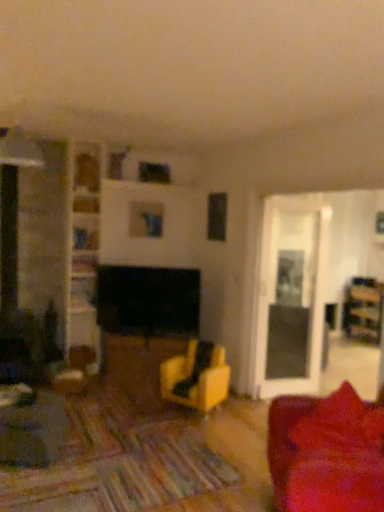
The image size is (384, 512). Describe the element at coordinates (327, 453) in the screenshot. I see `velvet red couch at lower right` at that location.

The width and height of the screenshot is (384, 512). What do you see at coordinates (364, 309) in the screenshot?
I see `wooden bookshelf at right` at bounding box center [364, 309].

Measure the distance between wooden bookshelf at left, the fourth shelf when ordered from top to bottom, and camera.

wooden bookshelf at left, the fourth shelf when ordered from top to bottom, and camera are 4.50 meters apart from each other.

You are a GUI agent. You are given a task and a screenshot of the screen. Output one action in this format:
    pyautogui.click(x=<x>, y=<y>)
    Task: Click on the wooden shelf at upper center, which is the 1th shelf from top to bottom
    This screenshot has height=512, width=384.
    Given the screenshot: What is the action you would take?
    pyautogui.click(x=86, y=204)

What is the approximate width of wooden bookshelf at center, the 3th shelf when ordered from top to bottom?

The width of wooden bookshelf at center, the 3th shelf when ordered from top to bottom, is 9.02 inches.

Identify the location of wooden bookshelf at center, the 3th shelf when ordered from top to bottom. (84, 264).

Where is `velvet red couch at lower right`? velvet red couch at lower right is located at coordinates (327, 453).

Considering the relative positions of wooden bookshelf at right and wooden bookshelf at center, which is the second shelf in bottom-to-top order, in the image provided, is wooden bookshelf at right to the left or to the right of wooden bookshelf at center, which is the second shelf in bottom-to-top order,?

Clearly, wooden bookshelf at right is on the right of wooden bookshelf at center, which is the second shelf in bottom-to-top order, in the image.

Is wooden bookshelf at right next to wooden bookshelf at center, which is the second shelf in bottom-to-top order?

No, wooden bookshelf at right is not making contact with wooden bookshelf at center, which is the second shelf in bottom-to-top order.

Considering the positions of objects wooden bookshelf at right and wooden bookshelf at center, the 3th shelf when ordered from top to bottom, in the image provided, who is in front, wooden bookshelf at right or wooden bookshelf at center, the 3th shelf when ordered from top to bottom,?

wooden bookshelf at center, the 3th shelf when ordered from top to bottom, is more forward.

From the picture: From the image's perspective, does wooden bookshelf at right appear lower than wooden bookshelf at center, the 3th shelf when ordered from top to bottom?

Indeed, from the image's perspective, wooden bookshelf at right is shown beneath wooden bookshelf at center, the 3th shelf when ordered from top to bottom.

Based on their sizes in the image, would you say velvet red couch at lower right is bigger or smaller than wooden shelf at upper center, which is the 1th shelf from top to bottom?

velvet red couch at lower right is bigger than wooden shelf at upper center, which is the 1th shelf from top to bottom.

Can you confirm if velvet red couch at lower right is shorter than wooden shelf at upper center, which is the 1th shelf from top to bottom?

In fact, velvet red couch at lower right may be taller than wooden shelf at upper center, which is the 1th shelf from top to bottom.

Can you tell me how much velvet red couch at lower right and wooden shelf at upper center, which is the 1th shelf from top to bottom, differ in facing direction?

106 degrees separate the facing orientations of velvet red couch at lower right and wooden shelf at upper center, which is the 1th shelf from top to bottom.

From the image's perspective, which is below, velvet red couch at lower right or wooden shelf at upper center, which ranks as the fourth shelf in bottom-to-top order?

From the image's view, velvet red couch at lower right is below.

Is matte yellow chair at center behind wooden bookshelf at right?

No, the depth of matte yellow chair at center is less than that of wooden bookshelf at right.

Does point (228, 386) come farther from viewer compared to point (378, 298)?

No.

Could wooden bookshelf at right be considered to be inside matte yellow chair at center?

No, wooden bookshelf at right is not surrounded by matte yellow chair at center.

Is matte yellow chair at center positioned with its back to wooden bookshelf at right?

Yes.

From the wooden shelf at upper center, which is the 1th shelf from top to bottom, count 2nd shelfs forward and point to it. Please provide its 2D coordinates.

[(83, 293)]

From the image's perspective, does wooden bookshelf at left, which is the first shelf from bottom to top, appear lower than wooden shelf at upper center, which ranks as the fourth shelf in bottom-to-top order?

Yes, from the image's perspective, wooden bookshelf at left, which is the first shelf from bottom to top, is below wooden shelf at upper center, which ranks as the fourth shelf in bottom-to-top order.

Considering the points (95, 296) and (97, 202), which point is behind, point (95, 296) or point (97, 202)?

The point (95, 296) is more distant.

Is wooden bookshelf at left, which is the first shelf from bottom to top, looking in the opposite direction of wooden shelf at upper center, which is the 1th shelf from top to bottom?

wooden bookshelf at left, which is the first shelf from bottom to top, does not have its back to wooden shelf at upper center, which is the 1th shelf from top to bottom.

Is wooden bookshelf at upper left, the second shelf from the top, wider or thinner than wooden shelf at upper center, which ranks as the fourth shelf in bottom-to-top order?

Considering their sizes, wooden bookshelf at upper left, the second shelf from the top, looks broader than wooden shelf at upper center, which ranks as the fourth shelf in bottom-to-top order.

From a real-world perspective, is wooden bookshelf at upper left, the second shelf from the top, above or below wooden shelf at upper center, which ranks as the fourth shelf in bottom-to-top order?

In terms of real-world spatial position, wooden bookshelf at upper left, the second shelf from the top, is below wooden shelf at upper center, which ranks as the fourth shelf in bottom-to-top order.

Is wooden bookshelf at upper left, which is counted as the third shelf, starting from the bottom, situated inside wooden shelf at upper center, which is the 1th shelf from top to bottom, or outside?

wooden bookshelf at upper left, which is counted as the third shelf, starting from the bottom, is spatially situated outside wooden shelf at upper center, which is the 1th shelf from top to bottom.

From the picture: Which of these two, wooden bookshelf at upper left, which is counted as the third shelf, starting from the bottom, or wooden shelf at upper center, which ranks as the fourth shelf in bottom-to-top order, stands shorter?

wooden shelf at upper center, which ranks as the fourth shelf in bottom-to-top order, is shorter.

Is point (152, 386) closer to camera compared to point (94, 229)?

Yes, point (152, 386) is in front of point (94, 229).

Is matte wood table at center to the right of wooden bookshelf at upper left, which is counted as the third shelf, starting from the bottom, from the viewer's perspective?

Yes.

How different are the orientations of matte wood table at center and wooden bookshelf at upper left, which is counted as the third shelf, starting from the bottom, in degrees?

The facing directions of matte wood table at center and wooden bookshelf at upper left, which is counted as the third shelf, starting from the bottom, are 31.7 degrees apart.

Considering the sizes of matte wood table at center and wooden bookshelf at upper left, the second shelf from the top, in the image, is matte wood table at center taller or shorter than wooden bookshelf at upper left, the second shelf from the top,?

In the image, matte wood table at center appears to be taller than wooden bookshelf at upper left, the second shelf from the top.

Would you consider matte wood table at center to be distant from velvet red couch at lower right?

That's right, there is a large distance between matte wood table at center and velvet red couch at lower right.

Does matte wood table at center turn towards velvet red couch at lower right?

Yes, matte wood table at center is facing velvet red couch at lower right.

Considering the positions of objects matte wood table at center and velvet red couch at lower right in the image provided, who is more to the left, matte wood table at center or velvet red couch at lower right?

matte wood table at center is more to the left.

Considering the sizes of objects matte wood table at center and velvet red couch at lower right in the image provided, who is wider, matte wood table at center or velvet red couch at lower right?

With larger width is velvet red couch at lower right.

Identify the location of shelf that is the 2nd one when counting upward from the wooden bookshelf at right (from the image's perspective). (84, 264).

You are a GUI agent. You are given a task and a screenshot of the screen. Output one action in this format:
    pyautogui.click(x=<x>, y=<y>)
    Task: Click on the studio couch that appears on the right of wooden shelf at upper center, which is the 1th shelf from top to bottom
    The image size is (384, 512).
    Given the screenshot: What is the action you would take?
    pyautogui.click(x=327, y=453)

Estimate the real-world distances between objects in this image. Which object is further from wooden shelf at upper center, which is the 1th shelf from top to bottom, wooden bookshelf at right or matte yellow chair at center?

wooden bookshelf at right lies further to wooden shelf at upper center, which is the 1th shelf from top to bottom, than the other object.

Estimate the real-world distances between objects in this image. Which object is closer to wooden bookshelf at upper left, the second shelf from the top, wooden bookshelf at center, the 3th shelf when ordered from top to bottom, or wooden shelf at upper center, which ranks as the fourth shelf in bottom-to-top order?

wooden shelf at upper center, which ranks as the fourth shelf in bottom-to-top order.

When comparing their distances from wooden bookshelf at left, which is the first shelf from bottom to top, does matte yellow chair at center or wooden bookshelf at right seem further?

The object further to wooden bookshelf at left, which is the first shelf from bottom to top, is wooden bookshelf at right.

From the image, which object appears to be nearer to matte yellow chair at center, wooden bookshelf at right or matte wood table at center?

matte wood table at center is positioned closer to the anchor matte yellow chair at center.

From the image, which object appears to be nearer to wooden bookshelf at left, which is the first shelf from bottom to top, velvet red couch at lower right or wooden bookshelf at right?

velvet red couch at lower right is positioned closer to the anchor wooden bookshelf at left, which is the first shelf from bottom to top.

Looking at the image, which one is located closer to wooden bookshelf at center, which is the second shelf in bottom-to-top order, velvet red couch at lower right or matte yellow chair at center?

matte yellow chair at center is positioned closer to the anchor wooden bookshelf at center, which is the second shelf in bottom-to-top order.

Estimate the real-world distances between objects in this image. Which object is closer to wooden bookshelf at left, which is the first shelf from bottom to top, wooden shelf at upper center, which ranks as the fourth shelf in bottom-to-top order, or matte yellow chair at center?

wooden shelf at upper center, which ranks as the fourth shelf in bottom-to-top order.

Looking at the image, which one is located closer to wooden bookshelf at center, the 3th shelf when ordered from top to bottom, wooden bookshelf at left, which is the first shelf from bottom to top, or wooden bookshelf at upper left, the second shelf from the top?

wooden bookshelf at left, which is the first shelf from bottom to top, is positioned closer to the anchor wooden bookshelf at center, the 3th shelf when ordered from top to bottom.

At what (x,y) coordinates should I click in order to perform the action: click on table between velvet red couch at lower right and wooden bookshelf at center, the 3th shelf when ordered from top to bottom, in the front-back direction. Please return your answer as a coordinate pair (x, y). Looking at the image, I should click on (139, 367).

At what (x,y) coordinates should I click in order to perform the action: click on table between wooden bookshelf at left, which is the first shelf from bottom to top, and matte yellow chair at center, in the horizontal direction. Please return your answer as a coordinate pair (x, y). The width and height of the screenshot is (384, 512). Looking at the image, I should click on (139, 367).

Identify the location of chair between matte wood table at center and wooden bookshelf at right. This screenshot has height=512, width=384. (196, 377).

Locate an element on the screen. The height and width of the screenshot is (512, 384). chair between wooden bookshelf at upper left, the second shelf from the top, and wooden bookshelf at right from left to right is located at coordinates (196, 377).